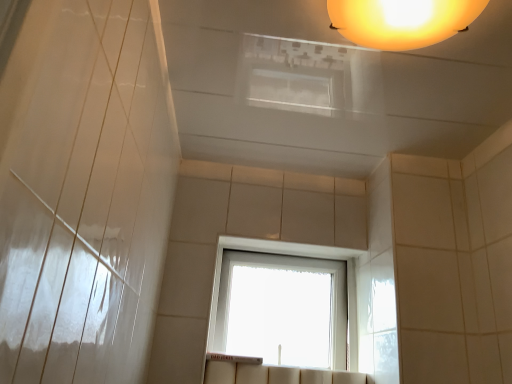
The image size is (512, 384). What do you see at coordinates (402, 21) in the screenshot? I see `matte orange globe at upper center` at bounding box center [402, 21].

Find the location of a particular element. matte orange globe at upper center is located at coordinates (402, 21).

What is the approximate height of transparent glass window at center?

It is 15.59 inches.

What do you see at coordinates (288, 254) in the screenshot? I see `transparent glass window at center` at bounding box center [288, 254].

Image resolution: width=512 pixels, height=384 pixels. I want to click on transparent glass window at center, so click(288, 254).

Where is `matte orange globe at upper center`? This screenshot has height=384, width=512. matte orange globe at upper center is located at coordinates (402, 21).

Between transparent glass window at center and matte orange globe at upper center, which one appears on the right side from the viewer's perspective?

Positioned to the right is matte orange globe at upper center.

Relative to matte orange globe at upper center, is transparent glass window at center in front or behind?

In the image, transparent glass window at center appears behind matte orange globe at upper center.

Is point (286, 243) positioned before point (407, 35)?

No, it is behind (407, 35).

From the image's perspective, who appears lower, transparent glass window at center or matte orange globe at upper center?

transparent glass window at center appears lower in the image.

From a real-world perspective, is transparent glass window at center above or below matte orange globe at upper center?

From a real-world perspective, transparent glass window at center is physically below matte orange globe at upper center.

Considering the relative sizes of transparent glass window at center and matte orange globe at upper center in the image provided, is transparent glass window at center wider than matte orange globe at upper center?

Incorrect, the width of transparent glass window at center does not surpass that of matte orange globe at upper center.

Can you confirm if transparent glass window at center is taller than matte orange globe at upper center?

Yes, transparent glass window at center is taller than matte orange globe at upper center.

Does transparent glass window at center have a smaller size compared to matte orange globe at upper center?

No, transparent glass window at center is not smaller than matte orange globe at upper center.

Is transparent glass window at center inside the boundaries of matte orange globe at upper center, or outside?

transparent glass window at center exists outside the volume of matte orange globe at upper center.

Consider the image. Are transparent glass window at center and matte orange globe at upper center far apart?

No, transparent glass window at center is in close proximity to matte orange globe at upper center.

Is transparent glass window at center oriented away from matte orange globe at upper center?

No, matte orange globe at upper center is not at the back of transparent glass window at center.

The height and width of the screenshot is (384, 512). I want to click on lamp on the right of transparent glass window at center, so click(402, 21).

Does matte orange globe at upper center appear on the right side of transparent glass window at center?

Yes.

Which object is further away from the camera, matte orange globe at upper center or transparent glass window at center?

transparent glass window at center is behind.

Is point (438, 4) positioned behind point (273, 242)?

No, it is not.

From the image's perspective, between matte orange globe at upper center and transparent glass window at center, which one is located above?

From the image's view, matte orange globe at upper center is above.

From a real-world perspective, is matte orange globe at upper center over transparent glass window at center?

Yes.

Is matte orange globe at upper center wider or thinner than transparent glass window at center?

Considering their sizes, matte orange globe at upper center looks broader than transparent glass window at center.

Which of these two, matte orange globe at upper center or transparent glass window at center, stands shorter?

With less height is matte orange globe at upper center.

Can you confirm if matte orange globe at upper center is bigger than transparent glass window at center?

No.

From the picture: Can transparent glass window at center be found inside matte orange globe at upper center?

Actually, transparent glass window at center is outside matte orange globe at upper center.

Is matte orange globe at upper center next to transparent glass window at center and touching it?

matte orange globe at upper center and transparent glass window at center are not in contact.

Is matte orange globe at upper center looking in the opposite direction of transparent glass window at center?

No, transparent glass window at center is not at the back of matte orange globe at upper center.

How many degrees apart are the facing directions of matte orange globe at upper center and transparent glass window at center?

The facing directions of matte orange globe at upper center and transparent glass window at center are 91.9 degrees apart.

Image resolution: width=512 pixels, height=384 pixels. Find the location of `window that is behind the matte orange globe at upper center`. window that is behind the matte orange globe at upper center is located at coordinates (288, 254).

There is a transparent glass window at center. At what (x,y) coordinates should I click in order to perform the action: click on lamp above it (from a real-world perspective). Please return your answer as a coordinate pair (x, y). Looking at the image, I should click on (402, 21).

You are a GUI agent. You are given a task and a screenshot of the screen. Output one action in this format:
    pyautogui.click(x=<x>, y=<y>)
    Task: Click on the window behind the matte orange globe at upper center
    The width and height of the screenshot is (512, 384).
    Given the screenshot: What is the action you would take?
    coord(288,254)